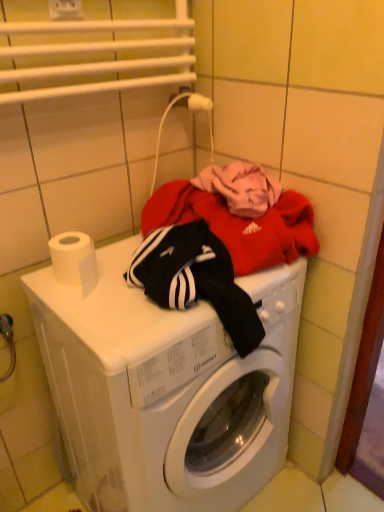
The image size is (384, 512). Describe the element at coordinates (166, 389) in the screenshot. I see `white plastic washing machine at center` at that location.

Locate an element on the screen. white plastic electric outlet at upper center is located at coordinates (65, 9).

From a real-world perspective, which is physically below, white matte toilet paper at upper left or white plastic washing machine at center?

In real-world perspective, white plastic washing machine at center is lower.

Which is correct: white matte toilet paper at upper left is inside white plastic washing machine at center, or outside of it?

white matte toilet paper at upper left is not enclosed by white plastic washing machine at center.

Is white plastic washing machine at center at the back of white matte toilet paper at upper left?

No.

Are white matte toilet paper at upper left and white plastic washing machine at center far apart?

No, there isn't a large distance between white matte toilet paper at upper left and white plastic washing machine at center.

Which is correct: white matte toilet paper at upper left is inside white plastic electric outlet at upper center, or outside of it?

white matte toilet paper at upper left is outside white plastic electric outlet at upper center.

Considering the relative positions of white matte toilet paper at upper left and white plastic electric outlet at upper center in the image provided, is white matte toilet paper at upper left behind white plastic electric outlet at upper center?

No, it is not.

Measure the distance between white matte toilet paper at upper left and white plastic electric outlet at upper center.

A distance of 49.74 centimeters exists between white matte toilet paper at upper left and white plastic electric outlet at upper center.

From their relative heights in the image, would you say white matte toilet paper at upper left is taller or shorter than white plastic electric outlet at upper center?

Considering their sizes, white matte toilet paper at upper left has more height than white plastic electric outlet at upper center.

Is point (123, 310) closer or farther from the camera than point (78, 18)?

Point (123, 310) is closer to the camera than point (78, 18).

Does white plastic washing machine at center turn towards white plastic electric outlet at upper center?

No, white plastic washing machine at center does not turn towards white plastic electric outlet at upper center.

Who is taller, white plastic washing machine at center or white plastic electric outlet at upper center?

white plastic washing machine at center is taller.

What's the angular difference between white plastic washing machine at center and white plastic electric outlet at upper center's facing directions?

0.774 degrees.

Which object is positioned more to the left, white plastic electric outlet at upper center or white matte toilet paper at upper left?

From the viewer's perspective, white plastic electric outlet at upper center appears more on the left side.

Based on the photo, considering the sizes of objects white plastic electric outlet at upper center and white matte toilet paper at upper left in the image provided, who is taller, white plastic electric outlet at upper center or white matte toilet paper at upper left?

white matte toilet paper at upper left is taller.

How different are the orientations of white plastic electric outlet at upper center and white matte toilet paper at upper left in degrees?

white plastic electric outlet at upper center and white matte toilet paper at upper left are facing 0.774 degrees away from each other.

From a real-world perspective, relative to white matte toilet paper at upper left, is white plastic washing machine at center vertically above or below?

white plastic washing machine at center is below white matte toilet paper at upper left.

From the image's perspective, which is above, white plastic washing machine at center or white matte toilet paper at upper left?

From the image's view, white matte toilet paper at upper left is above.

Who is smaller, white plastic washing machine at center or white matte toilet paper at upper left?

With smaller size is white matte toilet paper at upper left.

Consider the image. Considering the sizes of objects white plastic electric outlet at upper center and white plastic washing machine at center in the image provided, who is wider, white plastic electric outlet at upper center or white plastic washing machine at center?

With larger width is white plastic washing machine at center.

Is white plastic electric outlet at upper center looking in the opposite direction of white plastic washing machine at center?

That's not correct — white plastic electric outlet at upper center is not looking away from white plastic washing machine at center.

Is point (50, 7) more distant than point (108, 315)?

Yes, point (50, 7) is farther from viewer.

Considering the sizes of objects white plastic electric outlet at upper center and white plastic washing machine at center in the image provided, who is shorter, white plastic electric outlet at upper center or white plastic washing machine at center?

Standing shorter between the two is white plastic electric outlet at upper center.

You are a GUI agent. You are given a task and a screenshot of the screen. Output one action in this format:
    pyautogui.click(x=<x>, y=<y>)
    Task: Click on the toilet paper that is on the left side of white plastic washing machine at center
    
    Given the screenshot: What is the action you would take?
    pyautogui.click(x=74, y=260)

You are a GUI agent. You are given a task and a screenshot of the screen. Output one action in this format:
    pyautogui.click(x=<x>, y=<y>)
    Task: Click on the toilet paper that is in front of the white plastic electric outlet at upper center
    
    Given the screenshot: What is the action you would take?
    [74, 260]

Based on their spatial positions, is white plastic electric outlet at upper center or white plastic washing machine at center further from white matte toilet paper at upper left?

white plastic electric outlet at upper center is positioned further to the anchor white matte toilet paper at upper left.

From the image, which object appears to be farther from white plastic washing machine at center, white matte toilet paper at upper left or white plastic electric outlet at upper center?

white plastic electric outlet at upper center is further to white plastic washing machine at center.

Considering their positions, is white matte toilet paper at upper left positioned further to white plastic electric outlet at upper center than white plastic washing machine at center?

The object further to white plastic electric outlet at upper center is white plastic washing machine at center.

Which object lies further to the anchor point white matte toilet paper at upper left, white plastic washing machine at center or white plastic electric outlet at upper center?

white plastic electric outlet at upper center is further to white matte toilet paper at upper left.

Estimate the real-world distances between objects in this image. Which object is closer to white plastic electric outlet at upper center, white plastic washing machine at center or white matte toilet paper at upper left?

white matte toilet paper at upper left.

Looking at the image, which one is located further to white plastic washing machine at center, white plastic electric outlet at upper center or white matte toilet paper at upper left?

white plastic electric outlet at upper center is further to white plastic washing machine at center.

Find the location of `toilet paper between white plastic electric outlet at upper center and white plastic washing machine at center vertically`. toilet paper between white plastic electric outlet at upper center and white plastic washing machine at center vertically is located at coordinates (74, 260).